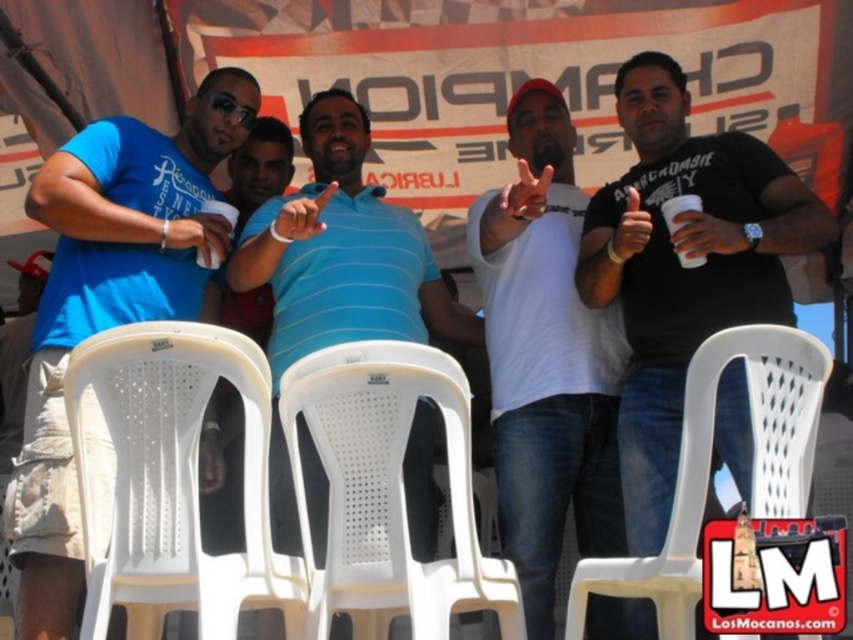
Does white matte t-shirt at center appear on the right side of matte khaki shorts at lower left?

Indeed, white matte t-shirt at center is positioned on the right side of matte khaki shorts at lower left.

Measure the distance between white matte t-shirt at center and matte khaki shorts at lower left.

white matte t-shirt at center and matte khaki shorts at lower left are 66.26 feet apart.

Is point (579, 317) positioned before point (18, 308)?

Yes, point (579, 317) is in front of point (18, 308).

The height and width of the screenshot is (640, 853). Identify the location of white matte t-shirt at center. (547, 365).

Does white matte t-shirt at center have a smaller size compared to matte black goggles at upper center?

Actually, white matte t-shirt at center might be larger than matte black goggles at upper center.

Consider the image. Does white matte t-shirt at center have a larger size compared to matte black goggles at upper center?

Indeed, white matte t-shirt at center has a larger size compared to matte black goggles at upper center.

Between point (515, 358) and point (248, 120), which one is positioned behind?

Positioned behind is point (248, 120).

The width and height of the screenshot is (853, 640). I want to click on white matte t-shirt at center, so click(547, 365).

Between point (445, 604) and point (20, 337), which one is positioned behind?

Point (20, 337)

Can you confirm if white plastic chair at center is smaller than matte khaki shorts at lower left?

No.

At what (x,y) coordinates should I click in order to perform the action: click on white plastic chair at center. Please return your answer as a coordinate pair (x, y). Image resolution: width=853 pixels, height=640 pixels. Looking at the image, I should click on (387, 492).

Find the location of a particular element. The width and height of the screenshot is (853, 640). white plastic chair at center is located at coordinates (387, 492).